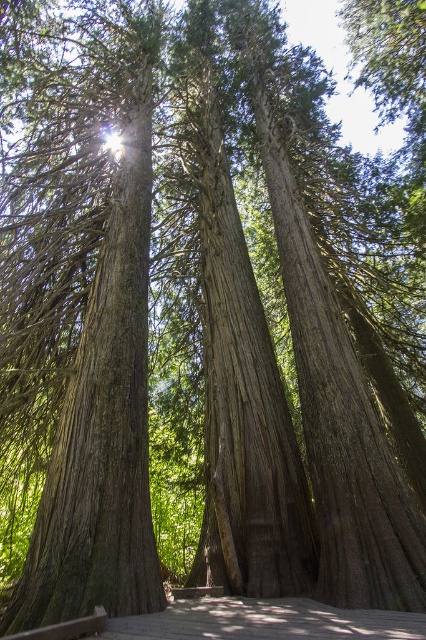
Question: Which point is farther to the camera?

Choices:
 (A) (206, 593)
 (B) (316, 604)
 (C) (126, 531)

Answer: (A)

Question: Does smooth brown tree trunk at center appear over wooden walkway at center?

Choices:
 (A) yes
 (B) no

Answer: (A)

Question: Is wooden walkway at center closer to camera compared to brown wooden park bench at center?

Choices:
 (A) no
 (B) yes

Answer: (B)

Question: Observing the image, what is the correct spatial positioning of smooth brown tree trunk at center in reference to brown wooden park bench at center?

Choices:
 (A) below
 (B) above

Answer: (B)

Question: Which of the following is the closest to the observer?

Choices:
 (A) wooden walkway at center
 (B) smooth brown tree trunk at center
 (C) brown wooden park bench at center

Answer: (A)

Question: Which point is closer to the camera?

Choices:
 (A) wooden walkway at center
 (B) brown wooden park bench at center

Answer: (A)